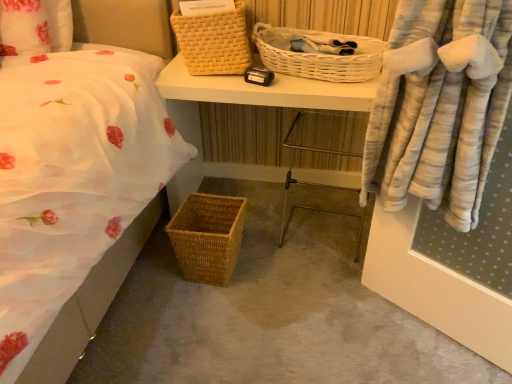
Question: Is woven wood desk at center facing towards woven brown picnic basket at lower left, which ranks as the third picnic basket in top-to-bottom order?

Choices:
 (A) yes
 (B) no

Answer: (A)

Question: Does woven wood desk at center come behind woven brown picnic basket at lower left, the first picnic basket positioned from the bottom?

Choices:
 (A) no
 (B) yes

Answer: (B)

Question: Is woven brown picnic basket at lower left, which ranks as the third picnic basket in top-to-bottom order, located within woven wood desk at center?

Choices:
 (A) yes
 (B) no

Answer: (B)

Question: Is woven wood desk at center turned away from woven brown picnic basket at lower left, the first picnic basket positioned from the bottom?

Choices:
 (A) no
 (B) yes

Answer: (A)

Question: From the image's perspective, does woven wood desk at center appear lower than woven brown picnic basket at lower left, which ranks as the third picnic basket in top-to-bottom order?

Choices:
 (A) no
 (B) yes

Answer: (A)

Question: Is woven wood desk at center positioned in front of woven brown picnic basket at lower left, which ranks as the third picnic basket in top-to-bottom order?

Choices:
 (A) no
 (B) yes

Answer: (A)

Question: Is white wicker picnic basket at upper center, the 2th picnic basket ordered from the bottom, positioned beyond the bounds of yellow woven picnic basket at upper center, arranged as the first picnic basket when viewed from the top?

Choices:
 (A) yes
 (B) no

Answer: (A)

Question: Is white wicker picnic basket at upper center, the 2th picnic basket from the top, oriented away from yellow woven picnic basket at upper center, the 3th picnic basket ordered from the bottom?

Choices:
 (A) no
 (B) yes

Answer: (A)

Question: From the image's perspective, is white wicker picnic basket at upper center, the 2th picnic basket ordered from the bottom, on yellow woven picnic basket at upper center, arranged as the first picnic basket when viewed from the top?

Choices:
 (A) yes
 (B) no

Answer: (B)

Question: Is white wicker picnic basket at upper center, the 2th picnic basket from the top, to the left of yellow woven picnic basket at upper center, arranged as the first picnic basket when viewed from the top, from the viewer's perspective?

Choices:
 (A) no
 (B) yes

Answer: (A)

Question: From a real-world perspective, does white wicker picnic basket at upper center, the 2th picnic basket from the top, stand above yellow woven picnic basket at upper center, the 3th picnic basket ordered from the bottom?

Choices:
 (A) no
 (B) yes

Answer: (A)

Question: Does white wicker picnic basket at upper center, the 2th picnic basket ordered from the bottom, have a smaller size compared to yellow woven picnic basket at upper center, arranged as the first picnic basket when viewed from the top?

Choices:
 (A) yes
 (B) no

Answer: (A)

Question: From the image's perspective, is woven brown picnic basket at lower left, which ranks as the third picnic basket in top-to-bottom order, below white wicker picnic basket at upper center, the 2th picnic basket from the top?

Choices:
 (A) yes
 (B) no

Answer: (A)